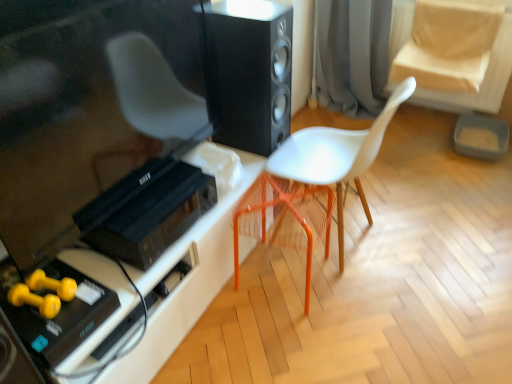
Question: Visually, is black matte speaker at center positioned to the left or to the right of orange plastic swivel chair at center?

Choices:
 (A) left
 (B) right

Answer: (A)

Question: From the image's perspective, is black matte speaker at center located above or below orange plastic swivel chair at center?

Choices:
 (A) above
 (B) below

Answer: (A)

Question: Which is nearer to the black plastic stereo at lower left?

Choices:
 (A) orange plastic swivel chair at center
 (B) black matte speaker at center
 (C) white plastic table at lower left
 (D) gray fabric curtain at upper center
 (E) white matte chair at center

Answer: (C)

Question: Estimate the real-world distances between objects in this image. Which object is farther from the black plastic stereo at lower left?

Choices:
 (A) white matte chair at center
 (B) gray fabric curtain at upper center
 (C) orange plastic swivel chair at center
 (D) white plastic table at lower left
 (E) black matte speaker at center

Answer: (B)